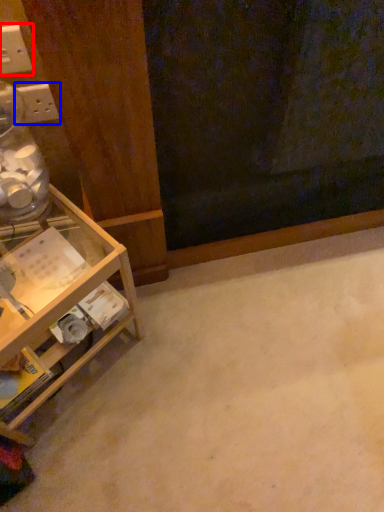
Question: Among these objects, which one is farthest to the camera, electric outlet (highlighted by a red box) or electric outlet (highlighted by a blue box)?

Choices:
 (A) electric outlet
 (B) electric outlet

Answer: (B)